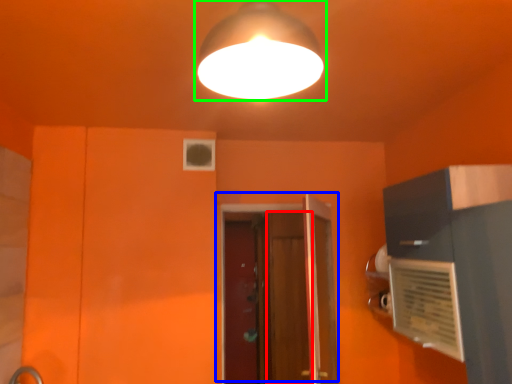
Question: Considering the real-world distances, which object is closest to screen door (highlighted by a red box)? door (highlighted by a blue box) or lamp (highlighted by a green box).

Choices:
 (A) door
 (B) lamp

Answer: (A)